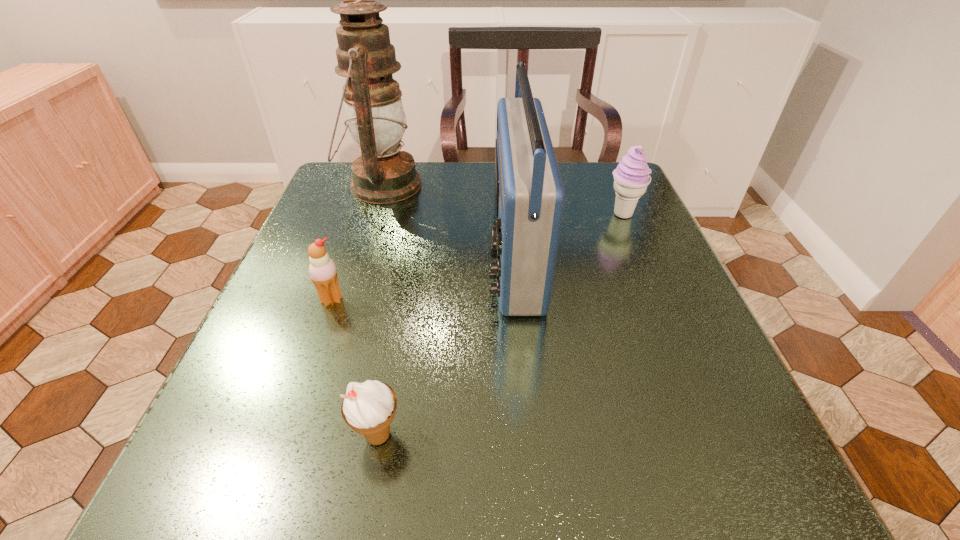
Locate an element on the screen. The image size is (960, 540). icecream that is at the left edge is located at coordinates tap(323, 273).

This screenshot has width=960, height=540. What are the coordinates of `object that is at the right edge` in the screenshot? It's located at (631, 177).

This screenshot has width=960, height=540. I want to click on object that is at the far left corner, so click(383, 174).

Identify the location of object that is at the far right corner. Image resolution: width=960 pixels, height=540 pixels. (631, 177).

The height and width of the screenshot is (540, 960). Find the location of `vacant position at the far edge of the desktop`. vacant position at the far edge of the desktop is located at coordinates (468, 168).

In the image, there is a desktop. Identify the location of vacant space at the near edge. This screenshot has height=540, width=960. (542, 453).

In the image, there is a desktop. At what (x,y) coordinates should I click in order to perform the action: click on blank space at the left edge. Please return your answer as a coordinate pair (x, y). The height and width of the screenshot is (540, 960). Looking at the image, I should click on (323, 409).

The height and width of the screenshot is (540, 960). Identify the location of vacant region at the right edge of the desktop. (636, 279).

In the image, there is a desktop. At what (x,y) coordinates should I click in order to perform the action: click on vacant space at the far left corner. Please return your answer as a coordinate pair (x, y). Looking at the image, I should click on (327, 198).

The height and width of the screenshot is (540, 960). I want to click on vacant position at the far right corner of the desktop, so click(x=596, y=206).